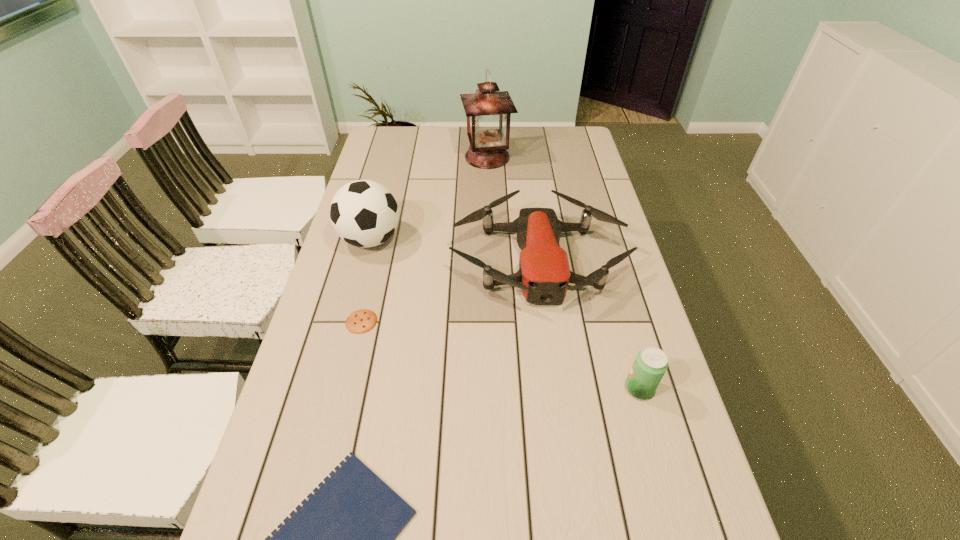
Where is `the tallest object`? The width and height of the screenshot is (960, 540). the tallest object is located at coordinates (488, 112).

What are the coordinates of `the farthest object` in the screenshot? It's located at (488, 112).

Identify the location of soccer ball. The width and height of the screenshot is (960, 540). (364, 213).

Locate an element on the screen. The width and height of the screenshot is (960, 540). soda is located at coordinates (650, 365).

This screenshot has width=960, height=540. I want to click on drone, so click(x=544, y=274).

Find the location of a particular element. This screenshot has width=960, height=540. cookie is located at coordinates (361, 321).

Find the location of a particular element. vacant space located on the right of the oil lamp is located at coordinates point(562,157).

Identify the location of free point located 0.390m on the front of the second tallest object. Image resolution: width=960 pixels, height=540 pixels. (336, 373).

Find the location of a particular element. free space located 0.350m on the left of the fifth farthest object is located at coordinates (476, 388).

Locate an element on the screen. This screenshot has height=540, width=960. vacant region located on the front-facing side of the drone is located at coordinates (552, 362).